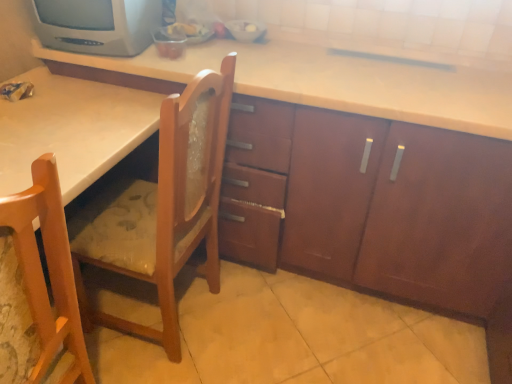
Question: Can you confirm if matte gray crt tv at upper left is bigger than wooden chair at center, acting as the 2th chair starting from the front?

Choices:
 (A) yes
 (B) no

Answer: (B)

Question: Considering the relative sizes of matte gray crt tv at upper left and wooden chair at center, acting as the 2th chair starting from the front, in the image provided, is matte gray crt tv at upper left wider than wooden chair at center, acting as the 2th chair starting from the front,?

Choices:
 (A) yes
 (B) no

Answer: (B)

Question: Is matte gray crt tv at upper left taller than wooden chair at center, acting as the 2th chair starting from the front?

Choices:
 (A) yes
 (B) no

Answer: (B)

Question: Does matte gray crt tv at upper left have a lesser width compared to wooden chair at center, which is the first chair from back to front?

Choices:
 (A) yes
 (B) no

Answer: (A)

Question: From a real-world perspective, is matte gray crt tv at upper left over wooden chair at center, acting as the 2th chair starting from the front?

Choices:
 (A) yes
 (B) no

Answer: (A)

Question: Is matte gray crt tv at upper left outside wooden chair at center, acting as the 2th chair starting from the front?

Choices:
 (A) yes
 (B) no

Answer: (A)

Question: Does light brown wood chair at lower left, which is the 2th chair from back to front, turn towards wooden chair at center, which is the first chair from back to front?

Choices:
 (A) yes
 (B) no

Answer: (B)

Question: Is light brown wood chair at lower left, acting as the 1th chair starting from the front, smaller than wooden chair at center, which is the first chair from back to front?

Choices:
 (A) yes
 (B) no

Answer: (A)

Question: Is light brown wood chair at lower left, acting as the 1th chair starting from the front, thinner than wooden chair at center, which is the first chair from back to front?

Choices:
 (A) no
 (B) yes

Answer: (B)

Question: Is light brown wood chair at lower left, which is the 2th chair from back to front, in front of wooden chair at center, acting as the 2th chair starting from the front?

Choices:
 (A) yes
 (B) no

Answer: (A)

Question: Is light brown wood chair at lower left, acting as the 1th chair starting from the front, not near wooden chair at center, which is the first chair from back to front?

Choices:
 (A) no
 (B) yes

Answer: (A)

Question: Is light brown wood chair at lower left, acting as the 1th chair starting from the front, at the left side of wooden chair at center, acting as the 2th chair starting from the front?

Choices:
 (A) yes
 (B) no

Answer: (A)

Question: Is light brown wood chair at lower left, acting as the 1th chair starting from the front, taller than matte gray crt tv at upper left?

Choices:
 (A) no
 (B) yes

Answer: (B)